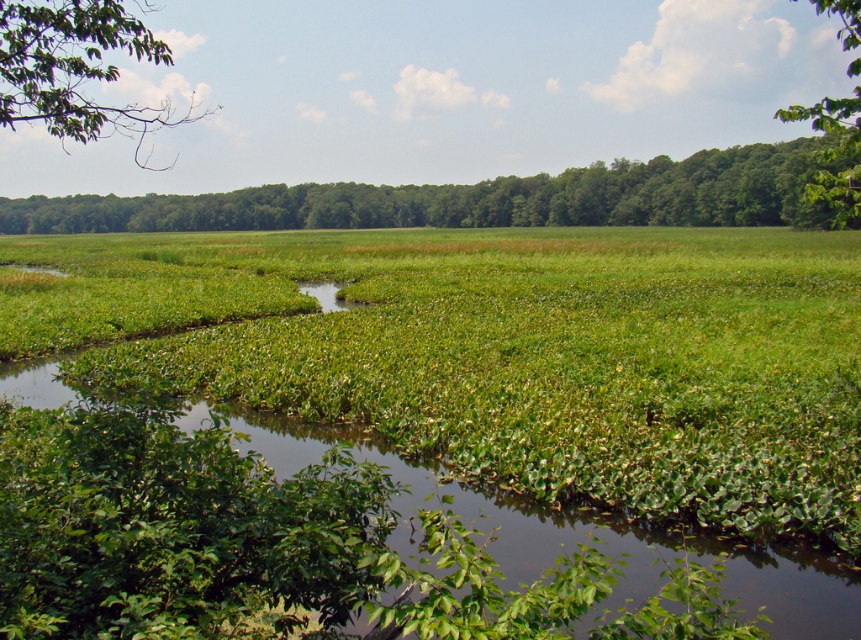
Can you confirm if green leafy tree at upper center is wider than green leafy tree at upper right?

Yes.

What do you see at coordinates (485, 198) in the screenshot?
I see `green leafy tree at upper center` at bounding box center [485, 198].

Identify the location of green leafy tree at upper center. The width and height of the screenshot is (861, 640). (485, 198).

Is green leafy vegetation at center wider than green leafy tree at upper right?

No, green leafy vegetation at center is not wider than green leafy tree at upper right.

Can you confirm if green leafy vegetation at center is positioned to the right of green leafy tree at upper right?

In fact, green leafy vegetation at center is to the left of green leafy tree at upper right.

Locate an element on the screen. The width and height of the screenshot is (861, 640). green leafy vegetation at center is located at coordinates (561, 541).

Who is positioned more to the right, green leafy branch at upper left or green leafy tree at upper right?

green leafy tree at upper right

Is point (57, 113) closer to camera compared to point (790, 108)?

That is True.

What do you see at coordinates (76, 68) in the screenshot?
I see `green leafy branch at upper left` at bounding box center [76, 68].

This screenshot has width=861, height=640. I want to click on green leafy branch at upper left, so click(76, 68).